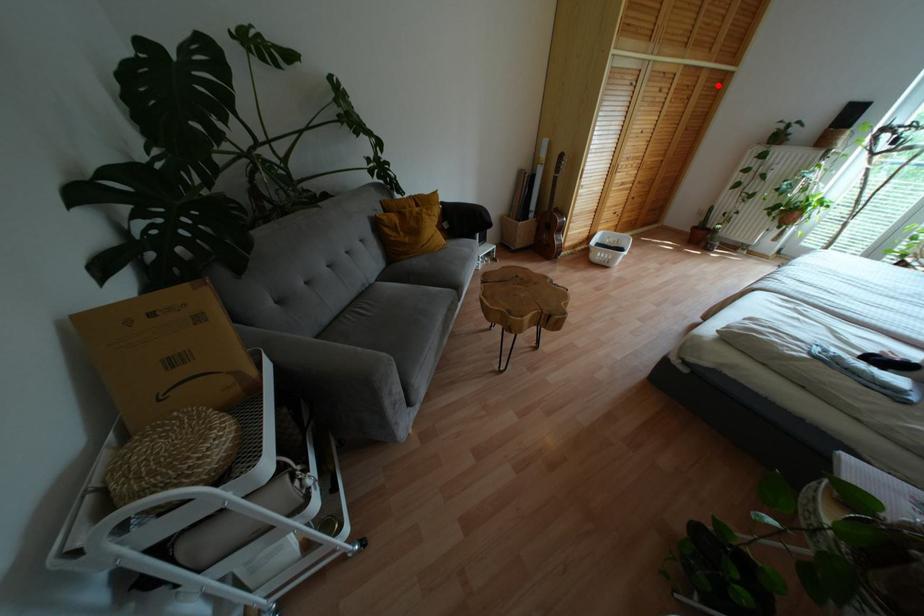
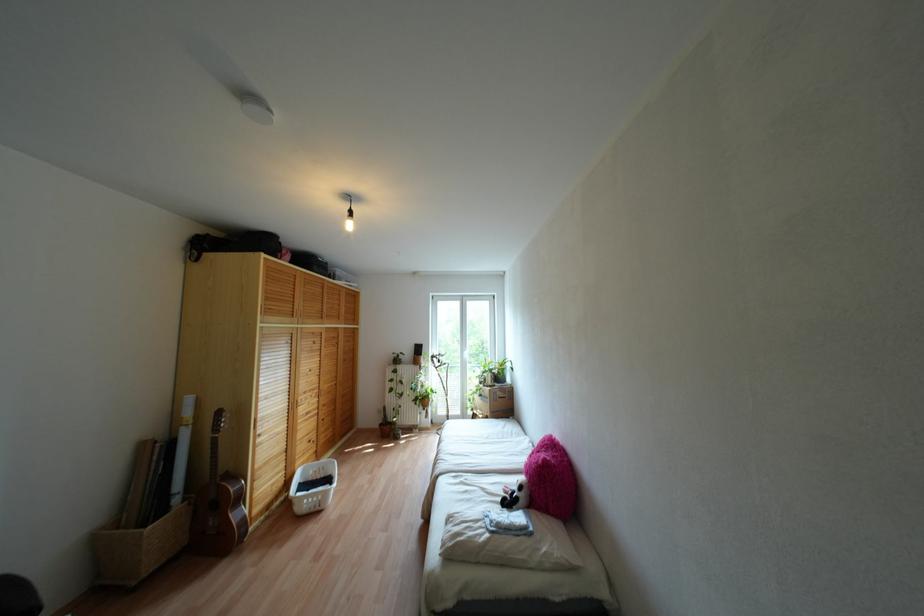
Question: I am providing you with two images of the same scene from different viewpoints. Given a red point in image1, look at the same physical point in image2. Is it:

Choices:
 (A) Closer to the viewpoint
 (B) Farther from the viewpoint

Answer: (A)